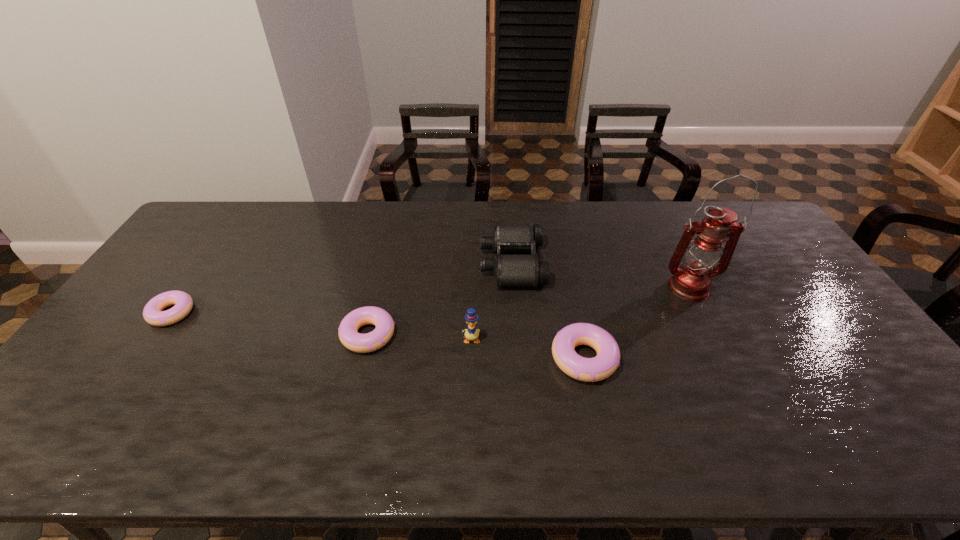
Where is `vacant area that satisfies the following two spatial constraints: 1. through the eyepieces of the binoculars; 2. on the face of the third object from left to right, where the monocle is placed`? vacant area that satisfies the following two spatial constraints: 1. through the eyepieces of the binoculars; 2. on the face of the third object from left to right, where the monocle is placed is located at coordinates (518, 340).

What are the coordinates of `free space in the image that satisfies the following two spatial constraints: 1. on the front side of the shortest object; 2. on the left side of the rightmost doughnut` in the screenshot? It's located at (141, 359).

At what (x,y) coordinates should I click in order to perform the action: click on blank area in the image that satisfies the following two spatial constraints: 1. through the eyepieces of the fourth shortest object; 2. on the back side of the oil lamp. Please return your answer as a coordinate pair (x, y). Looking at the image, I should click on (514, 288).

At what (x,y) coordinates should I click in order to perform the action: click on blank area in the image that satisfies the following two spatial constraints: 1. through the eyepieces of the fourth shortest object; 2. on the face of the duckling, where the monocle is placed. Please return your answer as a coordinate pair (x, y). The width and height of the screenshot is (960, 540). Looking at the image, I should click on (518, 340).